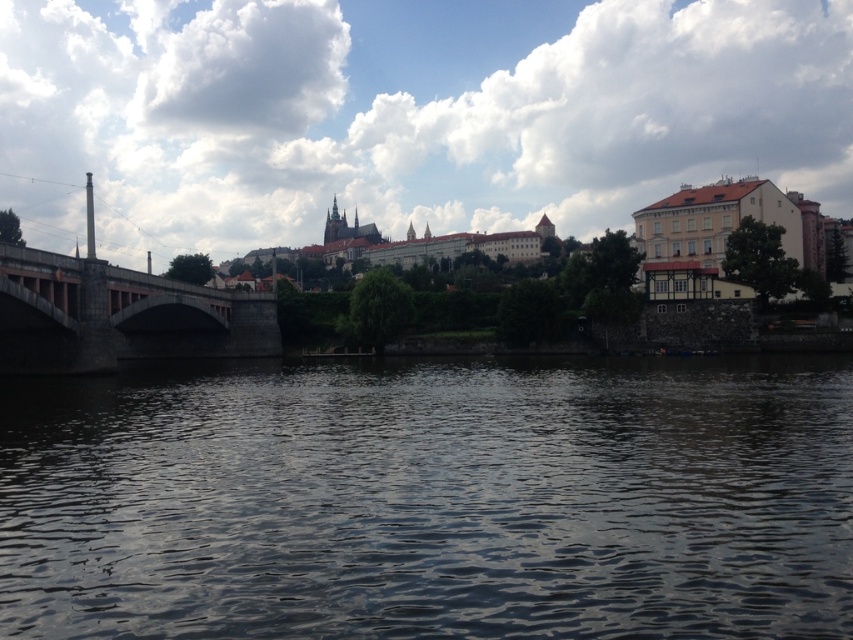
Between point (216, 456) and point (91, 259), which one is positioned behind?

The point (91, 259) is more distant.

Can you confirm if dark water at center is shorter than dark gray stone bridge at left?

Correct, dark water at center is not as tall as dark gray stone bridge at left.

Between point (223, 401) and point (22, 321), which one is positioned in front?

Point (223, 401) is in front.

At what (x,y) coordinates should I click in order to perform the action: click on dark water at center. Please return your answer as a coordinate pair (x, y). Looking at the image, I should click on (431, 500).